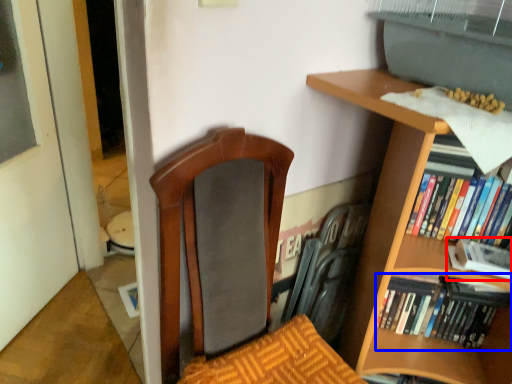
Question: Which of the following is the farthest to the observer, book (highlighted by a red box) or book (highlighted by a blue box)?

Choices:
 (A) book
 (B) book

Answer: (B)